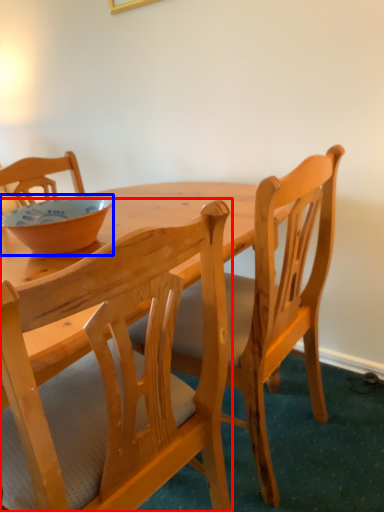
Question: Among these objects, which one is nearest to the camera, chair (highlighted by a red box) or bowl (highlighted by a blue box)?

Choices:
 (A) chair
 (B) bowl

Answer: (A)